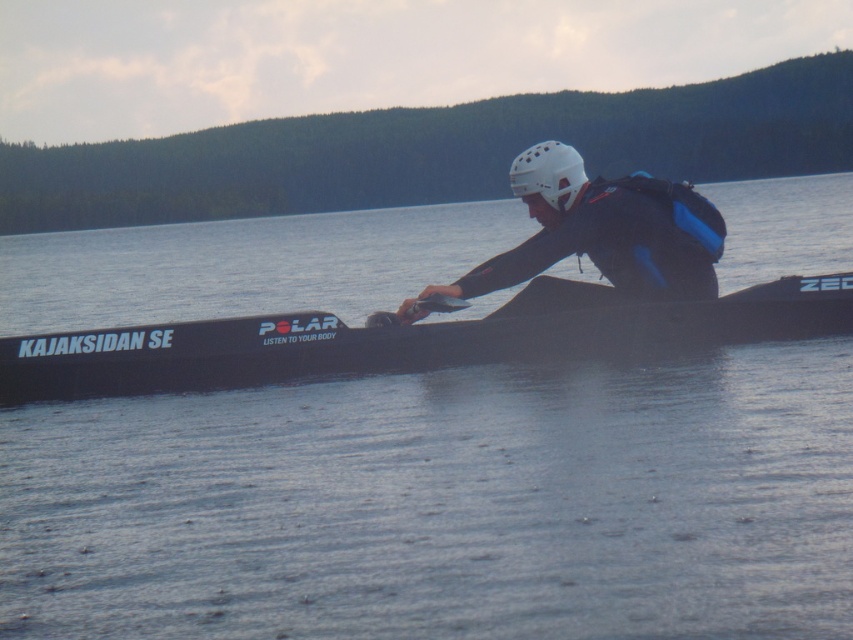
You are a safety inspector assessing the kayaker. Based on the scene, can you confirm if the transparent water at center is higher than the white matte helmet at center?

The transparent water at center has a greater height compared to the white matte helmet at center, so yes, the water is higher than the helmet.

You are a photographer trying to capture the kayaker in the image. You want to ensure the transparent water at center is visible in the photo. Where should you position your camera relative to the point at coordinates (444, 502)?

The transparent water at center is located at point (444, 502), so you should position your camera directly at that point to capture it clearly.

You are a photographer trying to capture the black matte kayak at center and the transparent water at center. Based on their positions, which object should you focus on first if you want to include both in a single frame without moving the camera?

The black matte kayak at center is to the right of the transparent water at center, so you should focus on the transparent water at center first to ensure both are in frame.